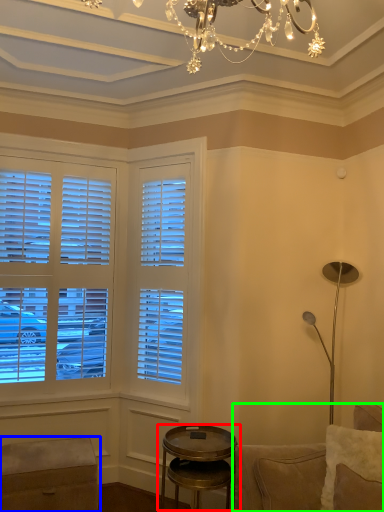
Question: Which is farther away from table (highlighted by a red box)? music stool (highlighted by a blue box) or studio couch (highlighted by a green box)?

Choices:
 (A) music stool
 (B) studio couch

Answer: (A)